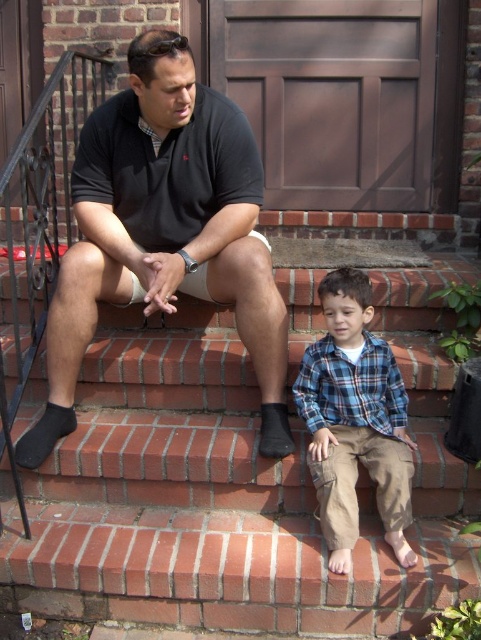
Who is positioned more to the left, black matte shirt at upper left or blue plaid shirt at lower center?

black matte shirt at upper left is more to the left.

Which is behind, point (88, 166) or point (351, 360)?

Point (88, 166)

This screenshot has height=640, width=481. In order to click on black matte shirt at upper left in this screenshot , I will do (164, 230).

Can you confirm if brick at center is positioned to the left of black matte shirt at upper left?

No, brick at center is not to the left of black matte shirt at upper left.

Who is lower down, brick at center or black matte shirt at upper left?

Positioned lower is brick at center.

Which is behind, point (110, 544) or point (154, 44)?

The point (110, 544) is more distant.

Where is `brick at center`? This screenshot has height=640, width=481. brick at center is located at coordinates (230, 484).

Does brick at center lie in front of blue plaid shirt at lower center?

Yes, brick at center is closer to the viewer.

Is point (437, 224) behind point (336, 308)?

Yes, point (437, 224) is behind point (336, 308).

Image resolution: width=481 pixels, height=640 pixels. What are the coordinates of `brick at center` in the screenshot? It's located at (230, 484).